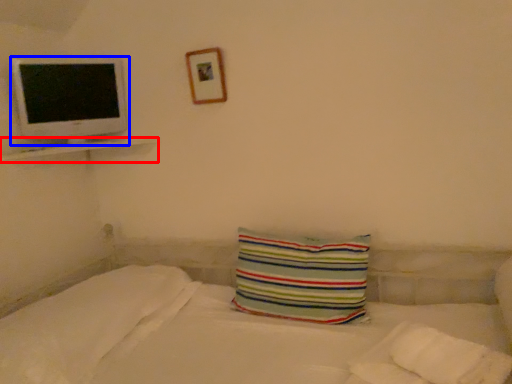
Question: Among these objects, which one is nearest to the camera, ledge (highlighted by a red box) or computer monitor (highlighted by a blue box)?

Choices:
 (A) ledge
 (B) computer monitor

Answer: (A)